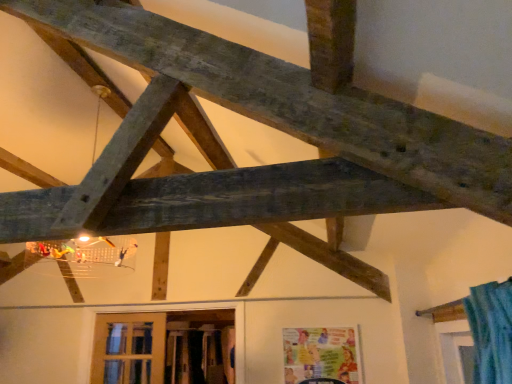
Question: Is wooden frame at lower center, the first window when ordered from right to left, inside the boundaries of wooden-framed window at lower left, the 2th window viewed from the right, or outside?

Choices:
 (A) outside
 (B) inside

Answer: (A)

Question: Considering the positions of point (143, 347) and point (116, 352), is point (143, 347) closer or farther from the camera than point (116, 352)?

Choices:
 (A) farther
 (B) closer

Answer: (B)

Question: Visually, is wooden frame at lower center, the first window when ordered from right to left, positioned to the left or to the right of wooden-framed window at lower left, the 2th window viewed from the right?

Choices:
 (A) right
 (B) left

Answer: (A)

Question: Based on their positions, is wooden-framed window at lower left, which is the first window in left-to-right order, located to the left or right of wooden frame at lower center, the first window when ordered from right to left?

Choices:
 (A) right
 (B) left

Answer: (B)

Question: In terms of width, does wooden-framed window at lower left, the 2th window viewed from the right, look wider or thinner when compared to wooden frame at lower center, the first window when ordered from right to left?

Choices:
 (A) thin
 (B) wide

Answer: (A)

Question: Considering their positions, is wooden-framed window at lower left, which is the first window in left-to-right order, located in front of or behind wooden frame at lower center, the first window when ordered from right to left?

Choices:
 (A) behind
 (B) front

Answer: (A)

Question: Considering the positions of wooden-framed window at lower left, which is the first window in left-to-right order, and wooden frame at lower center, the first window when ordered from right to left, in the image, is wooden-framed window at lower left, which is the first window in left-to-right order, bigger or smaller than wooden frame at lower center, the first window when ordered from right to left,?

Choices:
 (A) small
 (B) big

Answer: (A)